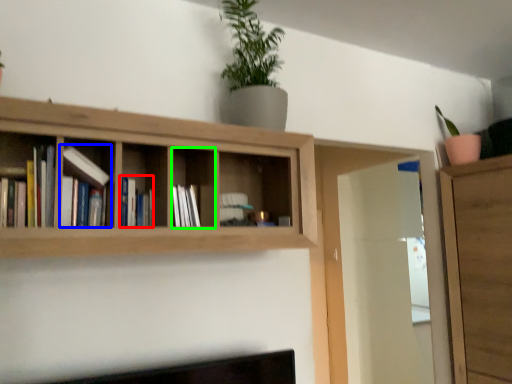
Question: Considering the real-world distances, which object is farthest from book (highlighted by a red box)? book (highlighted by a blue box) or cabinet (highlighted by a green box)?

Choices:
 (A) book
 (B) cabinet

Answer: (B)